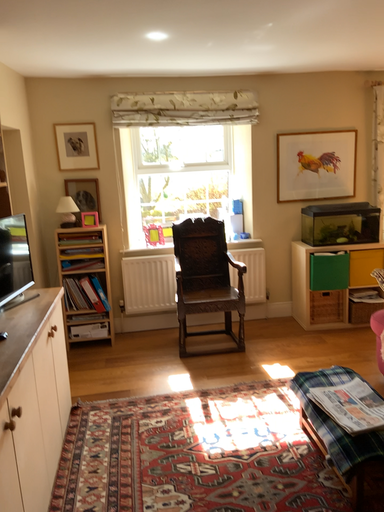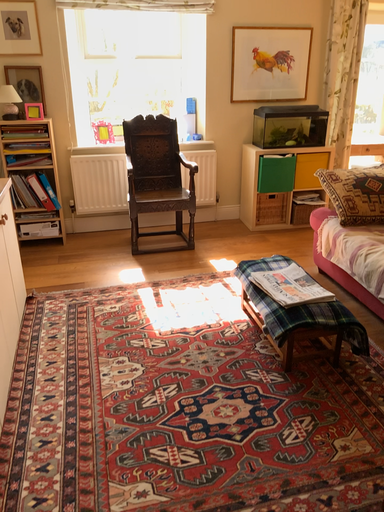
Question: How did the camera likely rotate when shooting the video?

Choices:
 (A) rotated downward
 (B) rotated upward

Answer: (A)